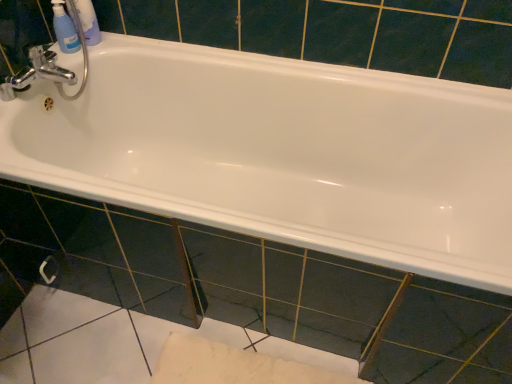
This screenshot has width=512, height=384. What are the coordinates of `free space to the right of translucent plastic bottles at upper left` in the screenshot? It's located at (125, 45).